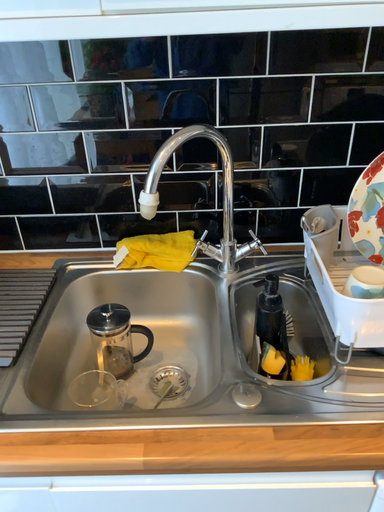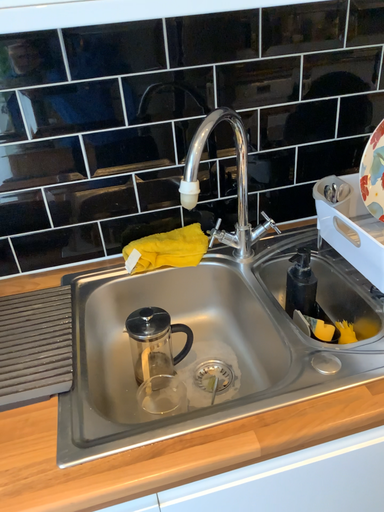
Question: Which way did the camera rotate in the video?

Choices:
 (A) rotated left
 (B) rotated right

Answer: (B)